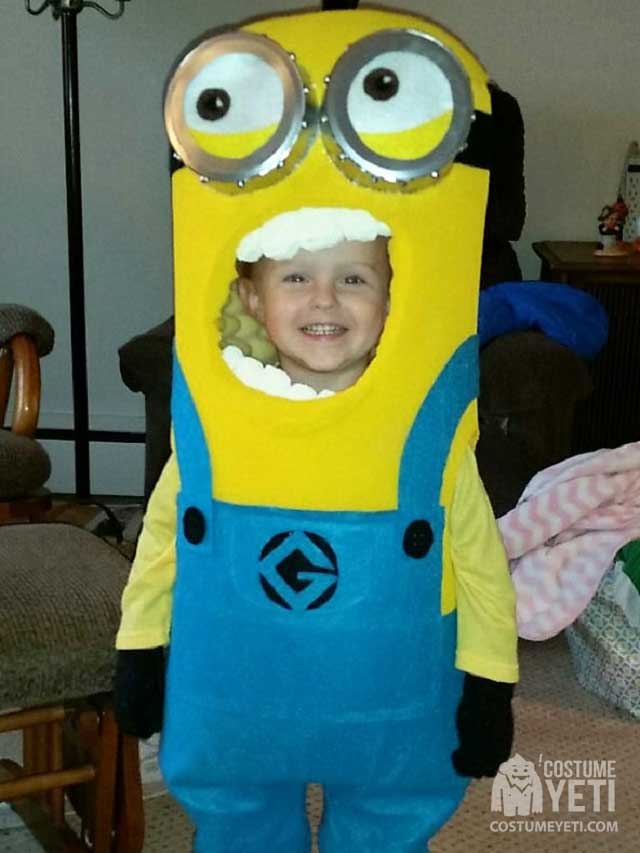
At what (x,y) coordinates should I click in order to perform the action: click on carpet. Please return your answer as a coordinate pair (x, y). Looking at the image, I should click on (554, 710).